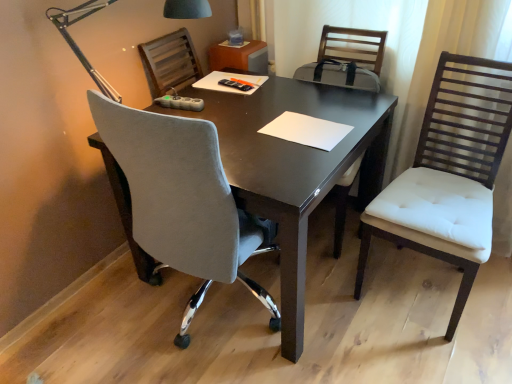
Where is `free space to the left of white paper at center`? This screenshot has height=384, width=512. free space to the left of white paper at center is located at coordinates (243, 130).